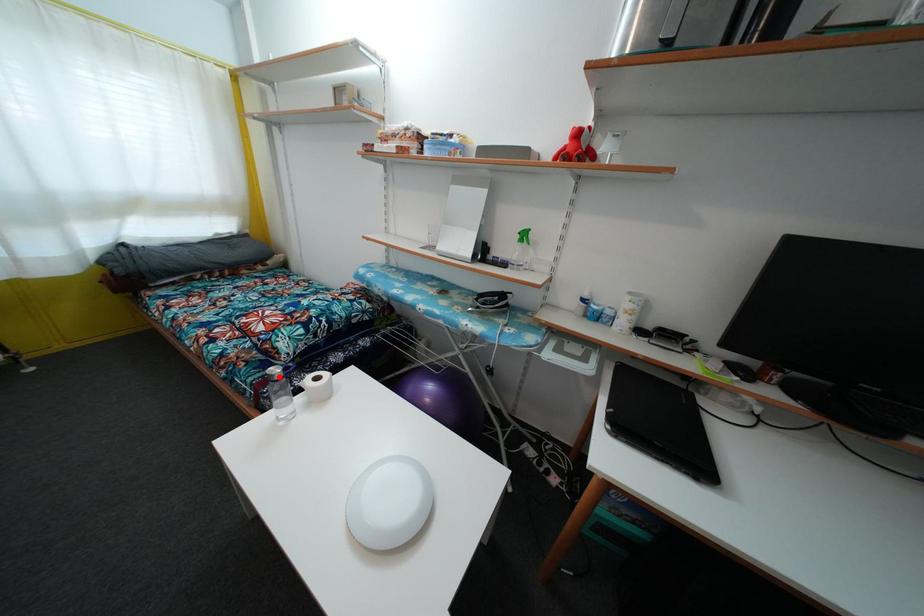
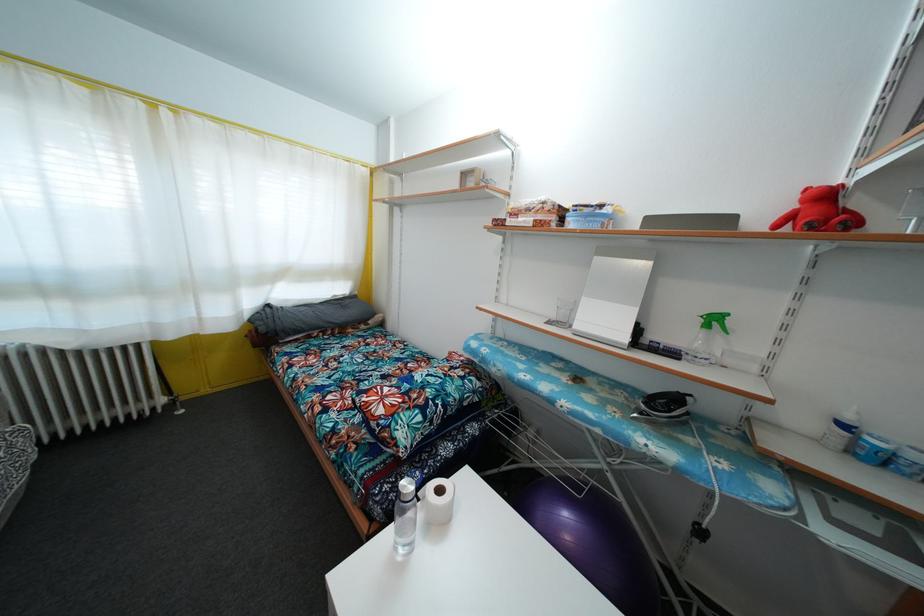
Find the pixel in the second image that matches the highlighted location in the first image.

(410, 492)